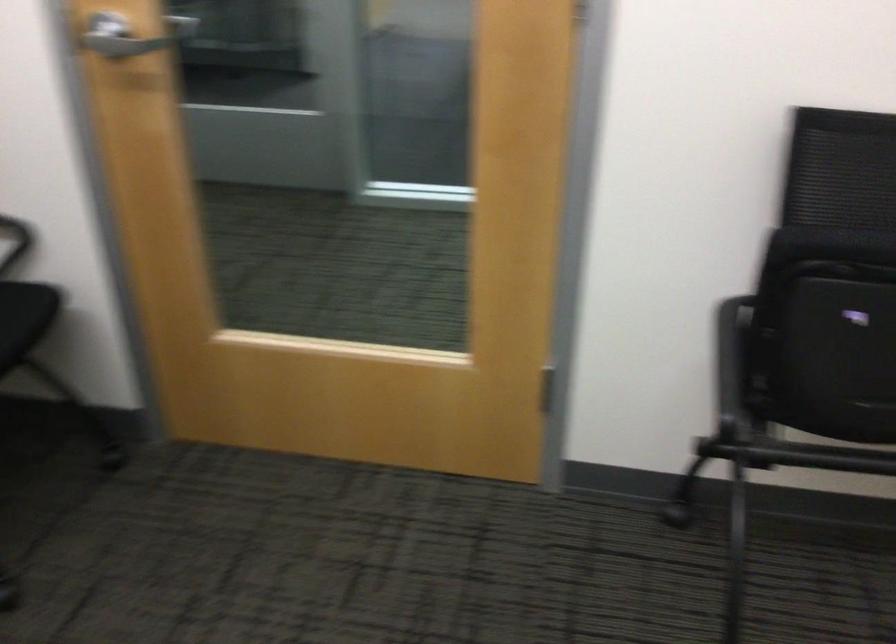
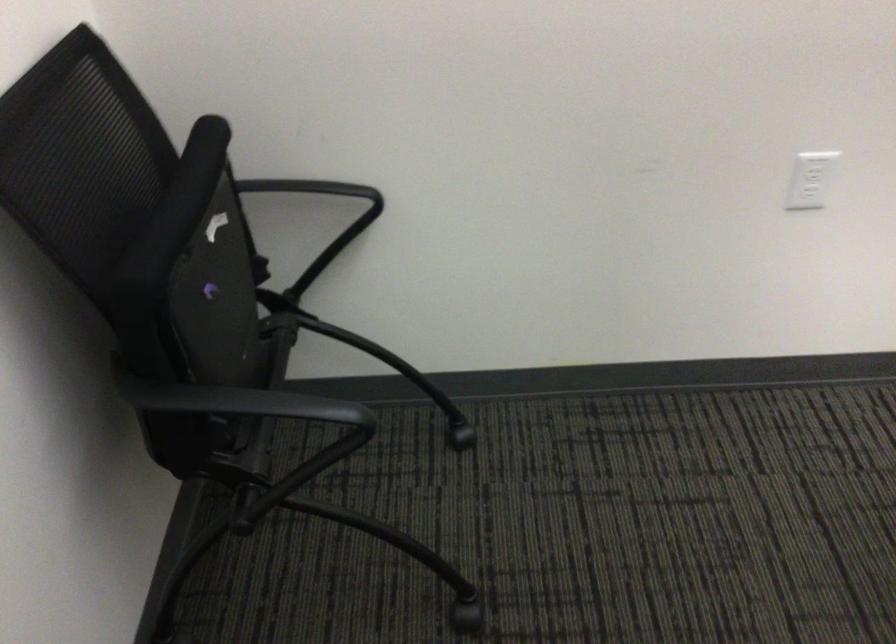
How did the camera likely rotate?

The camera's rotation is toward right-down.